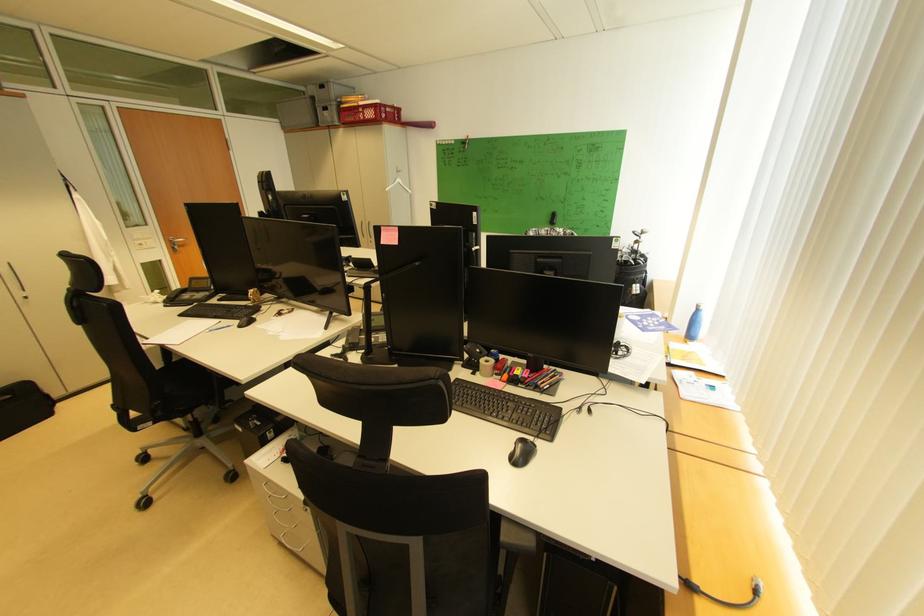
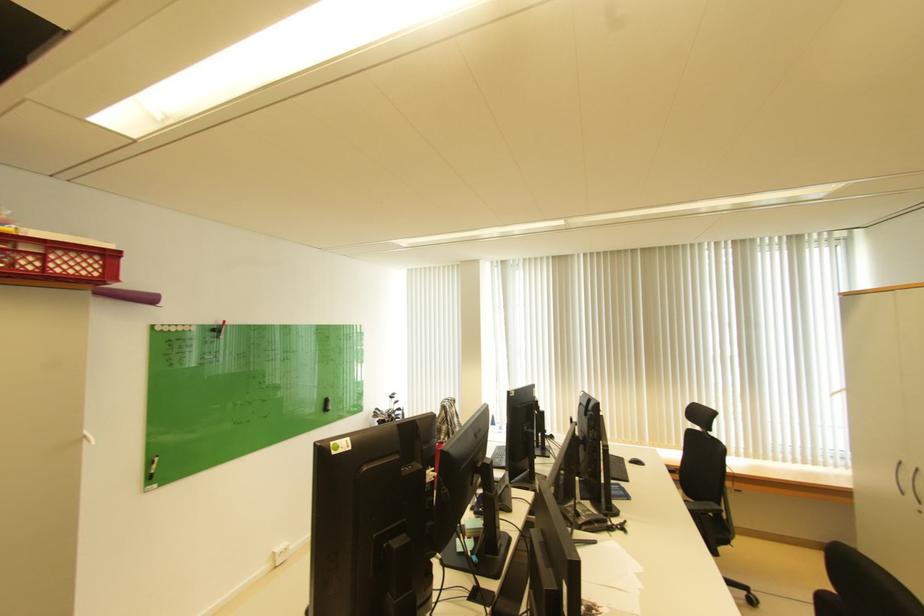
Find the pixel in the second image that matches pixel 372 118 in the first image.

(54, 268)